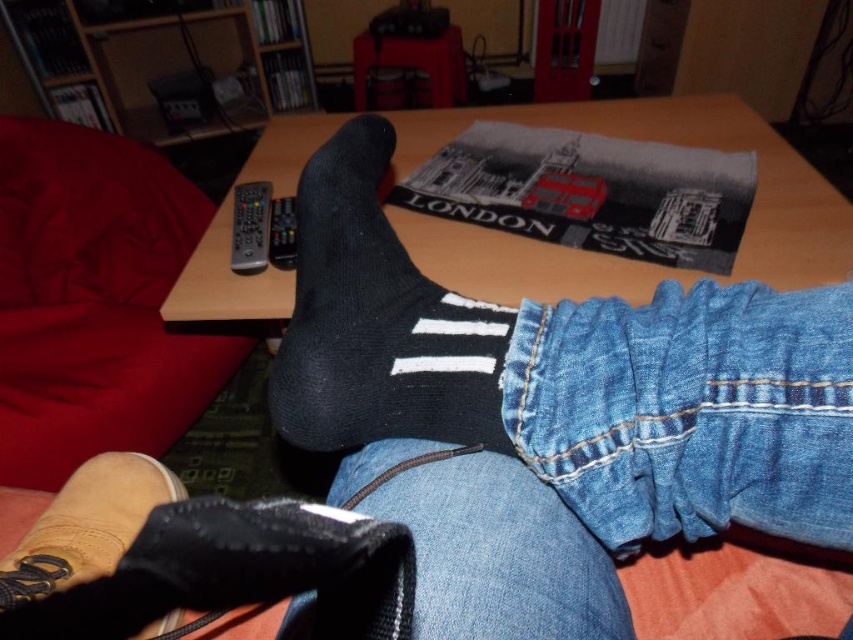
Question: Is wooden table at center thinner than black knitted sock at center?

Choices:
 (A) yes
 (B) no

Answer: (B)

Question: Which object is farther from the camera taking this photo?

Choices:
 (A) black plastic remote at upper left
 (B) black knitted sock at center

Answer: (A)

Question: Which of the following is the closest to the observer?

Choices:
 (A) (68, 554)
 (B) (834, 390)

Answer: (B)

Question: Which of the following is the closest to the observer?

Choices:
 (A) brown leather shoe at lower left
 (B) black suede sock at lower left
 (C) black plastic remote at center

Answer: (B)

Question: Is wooden table at center to the left of brown leather shoe at lower left from the viewer's perspective?

Choices:
 (A) no
 (B) yes

Answer: (A)

Question: Does wooden table at center appear on the left side of brown leather shoe at lower left?

Choices:
 (A) no
 (B) yes

Answer: (A)